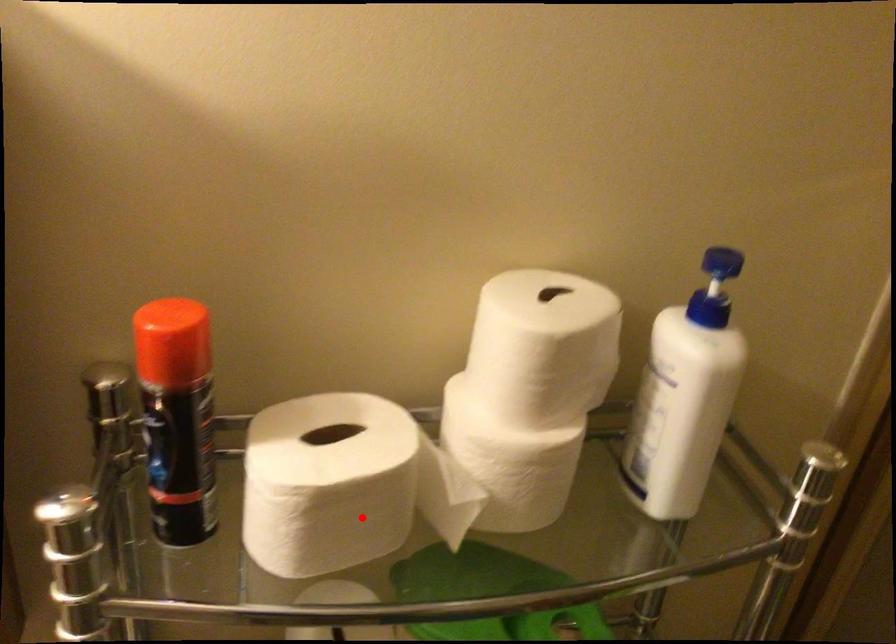
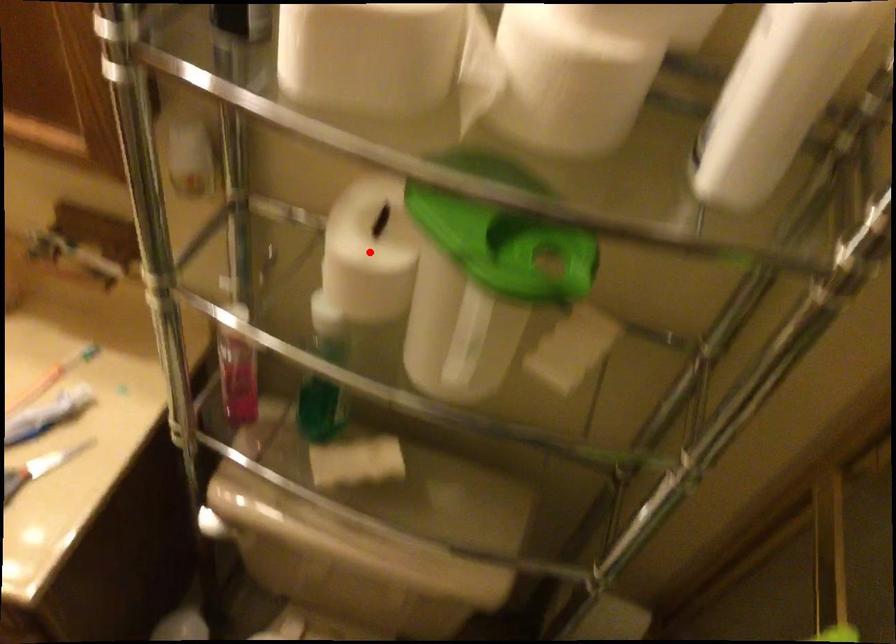
I am providing you with two images of the same scene from different viewpoints. A red point is marked on the first image and another point is marked on the second image. Does the point marked in image1 correspond to the same location as the one in image2?

No